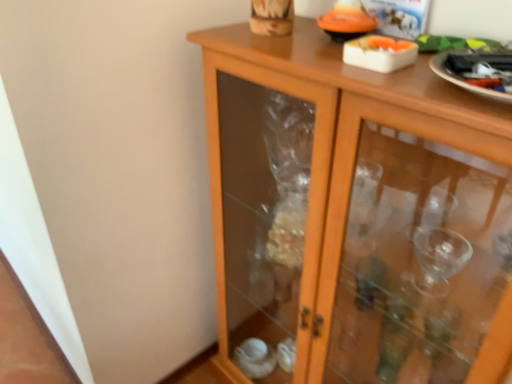
Question: Visually, is white glossy plate at upper right positioned to the left or to the right of wooden cabinet at center?

Choices:
 (A) right
 (B) left

Answer: (A)

Question: Is white glossy plate at upper right situated inside wooden cabinet at center or outside?

Choices:
 (A) inside
 (B) outside

Answer: (B)

Question: Considering their positions, is white glossy plate at upper right located in front of or behind wooden cabinet at center?

Choices:
 (A) front
 (B) behind

Answer: (B)

Question: Considering the positions of wooden cabinet at center and white glossy plate at upper right in the image, is wooden cabinet at center bigger or smaller than white glossy plate at upper right?

Choices:
 (A) small
 (B) big

Answer: (B)

Question: Based on their positions, is wooden cabinet at center located to the left or right of white glossy plate at upper right?

Choices:
 (A) left
 (B) right

Answer: (A)

Question: From a real-world perspective, is wooden cabinet at center physically located above or below white glossy plate at upper right?

Choices:
 (A) below
 (B) above

Answer: (A)

Question: From the image's perspective, is wooden cabinet at center positioned above or below white glossy plate at upper right?

Choices:
 (A) above
 (B) below

Answer: (B)